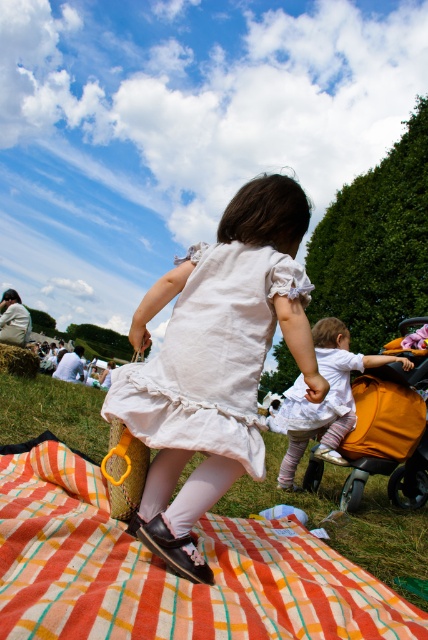
Question: Among these points, which one is nearest to the camera?

Choices:
 (A) (240, 598)
 (B) (413, 486)

Answer: (A)

Question: Does white cotton dress at center have a greater width compared to orange fabric baby carriage at lower right?

Choices:
 (A) no
 (B) yes

Answer: (A)

Question: Which object is the farthest from the white cotton dress at center?

Choices:
 (A) plaid fabric quilt at center
 (B) orange fabric baby carriage at lower right

Answer: (B)

Question: Is plaid fabric quilt at center positioned in front of white cotton dress at center?

Choices:
 (A) no
 (B) yes

Answer: (B)

Question: Is plaid fabric quilt at center closer to camera compared to orange fabric baby carriage at lower right?

Choices:
 (A) no
 (B) yes

Answer: (B)

Question: Which object appears farthest from the camera in this image?

Choices:
 (A) white cotton dress at center
 (B) plaid fabric quilt at center
 (C) orange fabric baby carriage at lower right

Answer: (C)